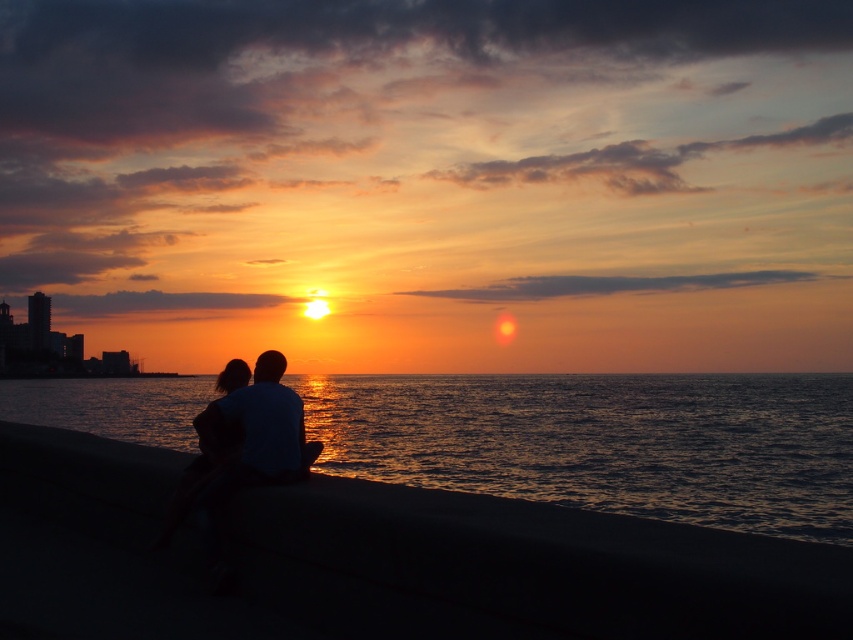
Between smooth concrete wall at lower center and shiny dark water at lower center, which one appears on the right side from the viewer's perspective?

Positioned to the right is shiny dark water at lower center.

In the scene shown: Which of these two, smooth concrete wall at lower center or shiny dark water at lower center, stands shorter?

With less height is smooth concrete wall at lower center.

Image resolution: width=853 pixels, height=640 pixels. Describe the element at coordinates (378, 561) in the screenshot. I see `smooth concrete wall at lower center` at that location.

In order to click on smooth concrete wall at lower center in this screenshot , I will do `click(378, 561)`.